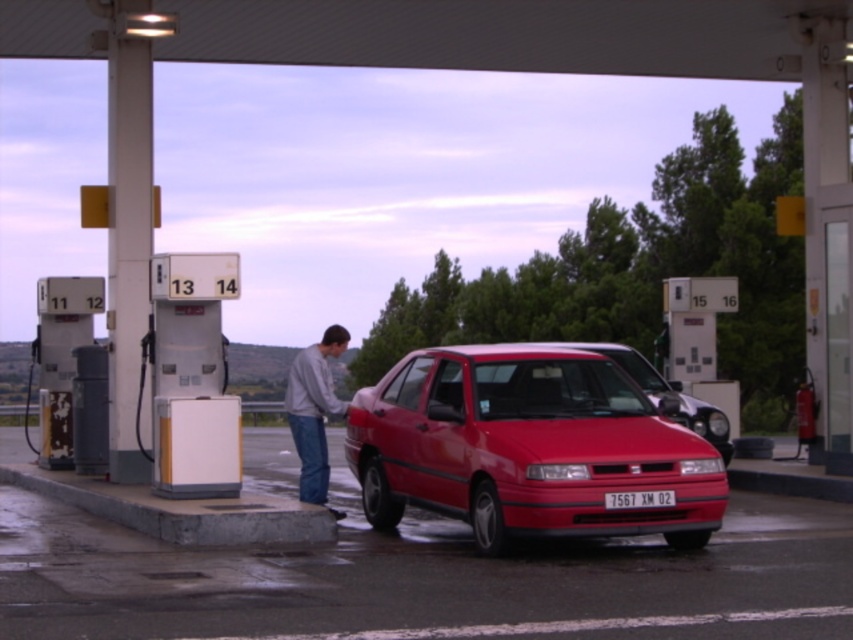
Question: Which of the following is the closest to the observer?

Choices:
 (A) (318, 426)
 (B) (663, 499)
 (C) (711, 432)
 (D) (532, 509)

Answer: (D)

Question: Does shiny red sedan at center appear on the right side of gray cotton shirt at center?

Choices:
 (A) yes
 (B) no

Answer: (A)

Question: Which point appears farthest from the camera in this image?

Choices:
 (A) (672, 492)
 (B) (625, 344)
 (C) (572, 388)

Answer: (B)

Question: Is shiny red sedan at center thinner than matte red sedan at center?

Choices:
 (A) yes
 (B) no

Answer: (A)

Question: Can you confirm if shiny red sedan at center is thinner than matte red sedan at center?

Choices:
 (A) yes
 (B) no

Answer: (A)

Question: Considering the real-world distances, which object is farthest from the gray cotton shirt at center?

Choices:
 (A) matte red sedan at center
 (B) shiny red sedan at center

Answer: (A)